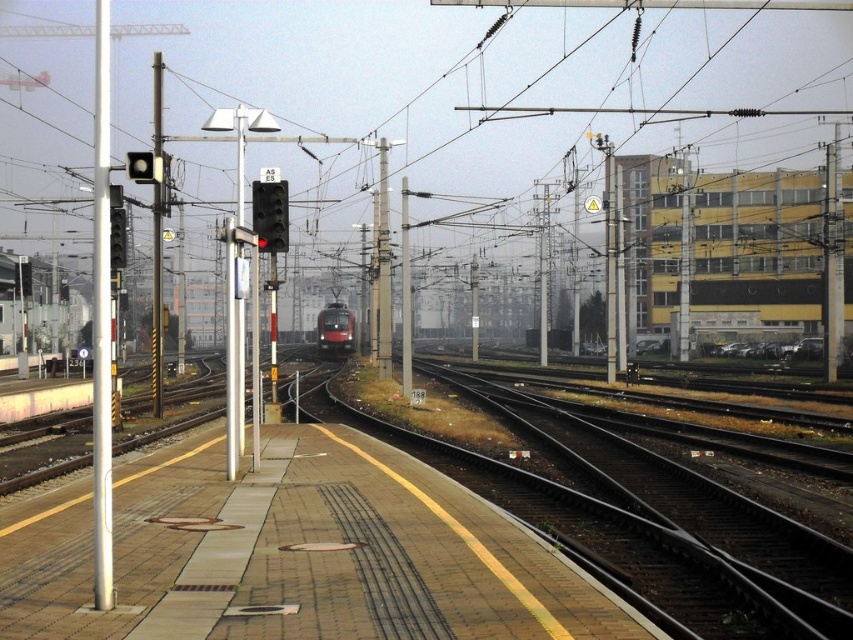
You are a train conductor who needs to check the distance between the white metallic pole at left and the red glossy train at center to ensure safety. According to the scene description, can you determine which object is closer to the platform edge?

The white metallic pole at left is positioned on the left side of the red glossy train at center, so the pole is closer to the platform edge than the train.

You are a maintenance worker on the platform and need to place a 1.2 meter wide equipment box between the brick platform at center and the white metallic pole at left. Can you fit it there?

The brick platform at center is thinner than the white metallic pole at left, but the description does not provide exact measurements of their widths. Therefore, it is uncertain if the 1.2 meter wide equipment box can fit between them without knowing the actual space available.

You are standing at the center of the platform and want to locate the white metallic pole at left. Based on the coordinates given, in which direction should you look to find it?

The white metallic pole at left is located at coordinates 0.502 in the x direction and 0.120 in the y direction. Since the x coordinate is 0.502, which is near the center, and the y coordinate is 0.120, which is towards the bottom of the image, you should look towards the bottom left direction to find it.